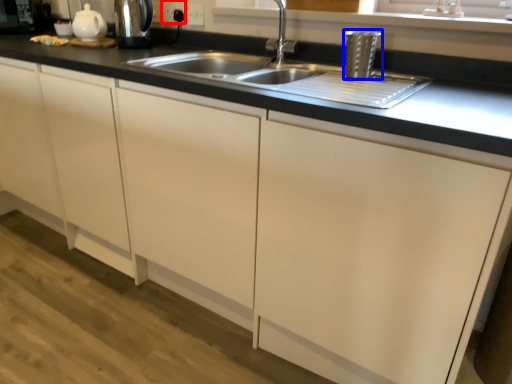
Question: Among these objects, which one is farthest to the camera, electric outlet (highlighted by a red box) or appliance (highlighted by a blue box)?

Choices:
 (A) electric outlet
 (B) appliance

Answer: (A)